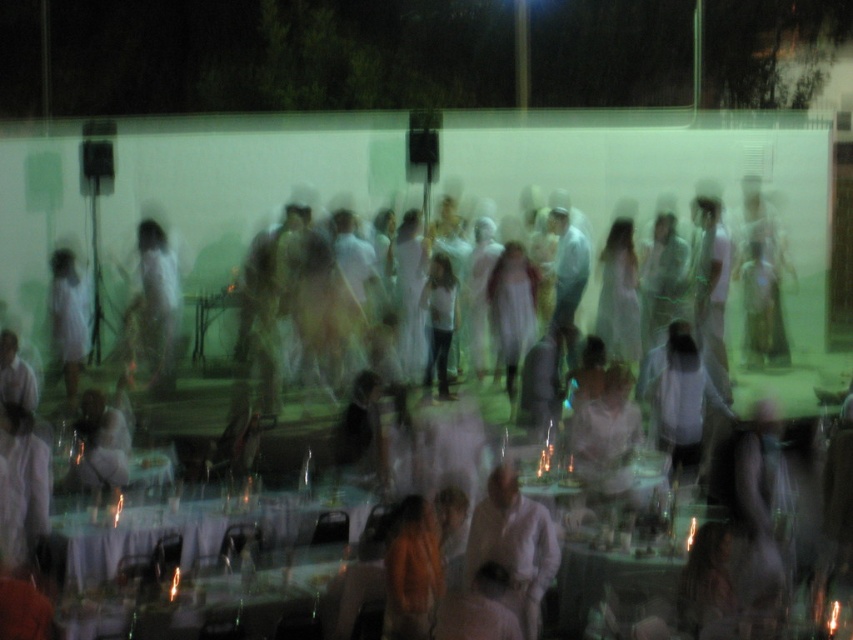
Is the position of white lace tablecloth at lower left more distant than that of white sheer dress at center?

No.

In the scene shown: Which of these two, white lace tablecloth at lower left or white sheer dress at center, stands shorter?

Standing shorter between the two is white lace tablecloth at lower left.

You are a GUI agent. You are given a task and a screenshot of the screen. Output one action in this format:
    pyautogui.click(x=<x>, y=<y>)
    Task: Click on the white lace tablecloth at lower left
    The image size is (853, 640).
    Given the screenshot: What is the action you would take?
    pyautogui.click(x=198, y=529)

Which is more to the right, white sheer fabric at center or white matte shirt at center?

white sheer fabric at center

Describe the element at coordinates (535, 404) in the screenshot. I see `white sheer fabric at center` at that location.

Between point (201, 195) and point (525, 566), which one is positioned in front?

Point (525, 566) is more forward.

Locate an element on the screen. Image resolution: width=853 pixels, height=640 pixels. white sheer fabric at center is located at coordinates (535, 404).

Based on the photo, does white matte shirt at center have a lesser width compared to white sheer dress at center?

In fact, white matte shirt at center might be wider than white sheer dress at center.

Can you confirm if white matte shirt at center is smaller than white sheer dress at center?

Indeed, white matte shirt at center has a smaller size compared to white sheer dress at center.

Is point (526, 570) behind point (79, 332)?

No, (526, 570) is closer to viewer.

The width and height of the screenshot is (853, 640). In order to click on white matte shirt at center in this screenshot , I will do `click(514, 545)`.